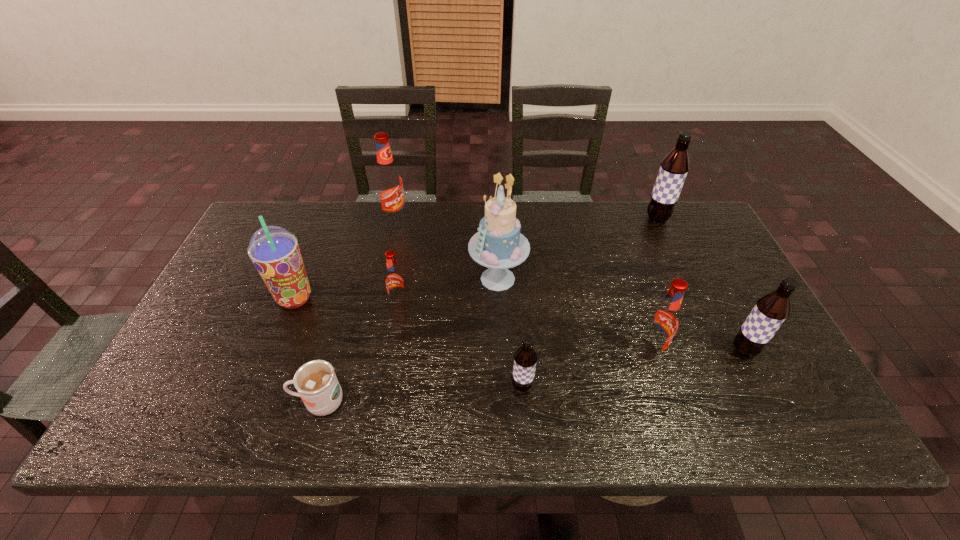
Locate an element on the screen. The width and height of the screenshot is (960, 540). unoccupied area between the smallest brown root beer and the farthest red root beer is located at coordinates (459, 303).

Find the location of `vacant area between the cake and the third root beer from right to left`. vacant area between the cake and the third root beer from right to left is located at coordinates (574, 315).

Identify the location of free space between the smallest red root beer and the cake. (448, 291).

Identify which object is the sixth nearest to the smoothie. Please provide its 2D coordinates. Your answer should be formatted as a tuple, i.e. [(x, y)], where the tuple contains the x and y coordinates of a point satisfying the conditions above.

[(663, 321)]

Identify which object is the eighth closest to the smallest red root beer. Please provide its 2D coordinates. Your answer should be formatted as a tuple, i.e. [(x, y)], where the tuple contains the x and y coordinates of a point satisfying the conditions above.

[(770, 311)]

Identify the location of root beer that is the third closest to the smoothie. (525, 358).

Locate an element on the screen. The height and width of the screenshot is (540, 960). root beer identified as the second closest to the biggest brown root beer is located at coordinates (663, 321).

At what (x,y) coordinates should I click in order to perform the action: click on the second closest brown root beer relative to the second farthest brown root beer. Please return your answer as a coordinate pair (x, y). Looking at the image, I should click on (525, 358).

Where is `brown root beer that is the closest to the smallest red root beer`? The height and width of the screenshot is (540, 960). brown root beer that is the closest to the smallest red root beer is located at coordinates (525, 358).

Image resolution: width=960 pixels, height=540 pixels. Identify the location of red root beer identified as the second closest to the seventh object from left to right. (388, 180).